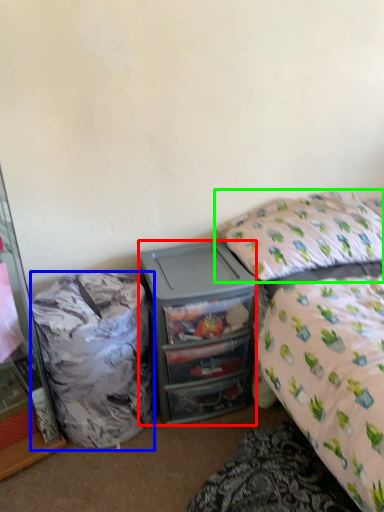
Question: Based on their relative distances, which object is farther from desk (highlighted by a red box)? Choose from trash bin/can (highlighted by a blue box) and pillow (highlighted by a green box).

Choices:
 (A) trash bin/can
 (B) pillow

Answer: (B)